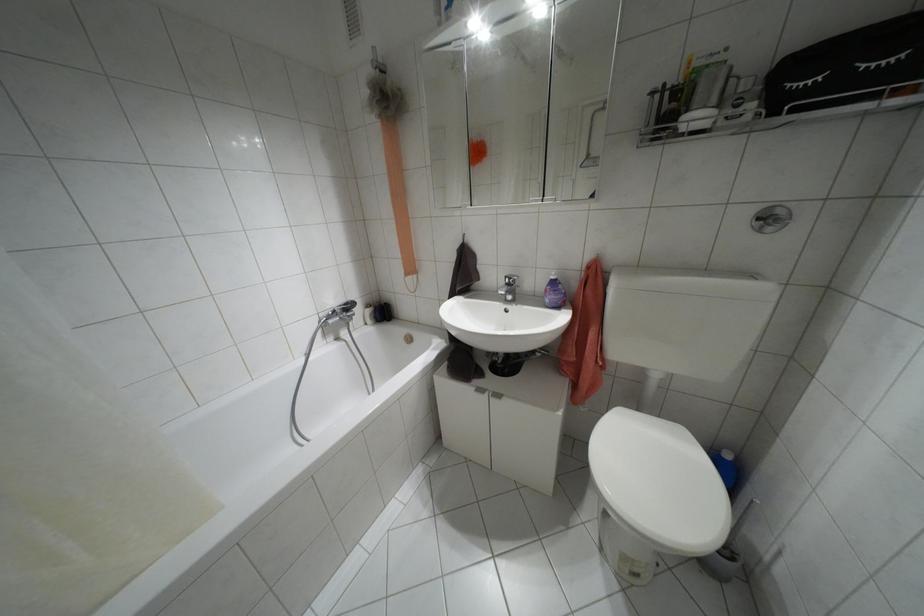
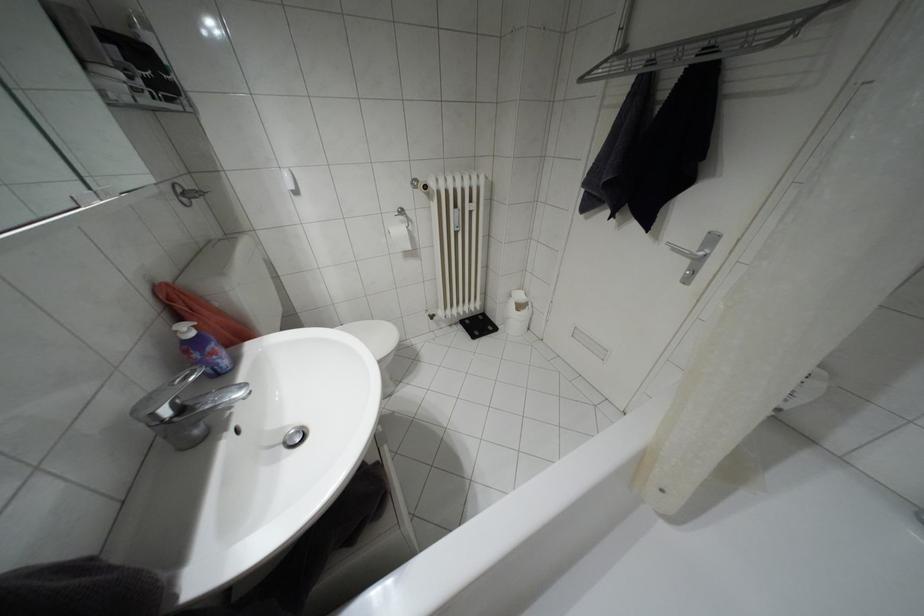
The point at (552, 277) is marked in the first image. Where is the corresponding point in the second image?

(190, 333)